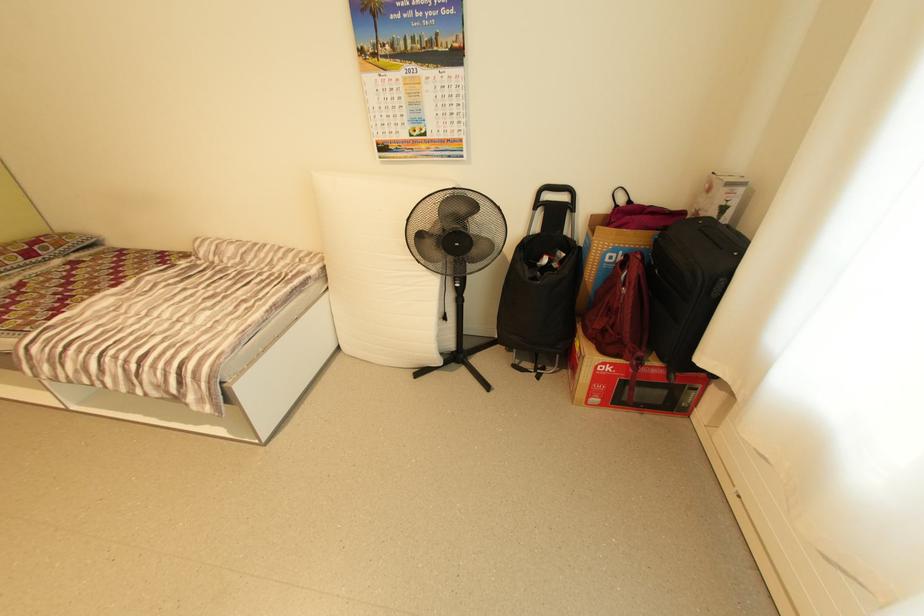
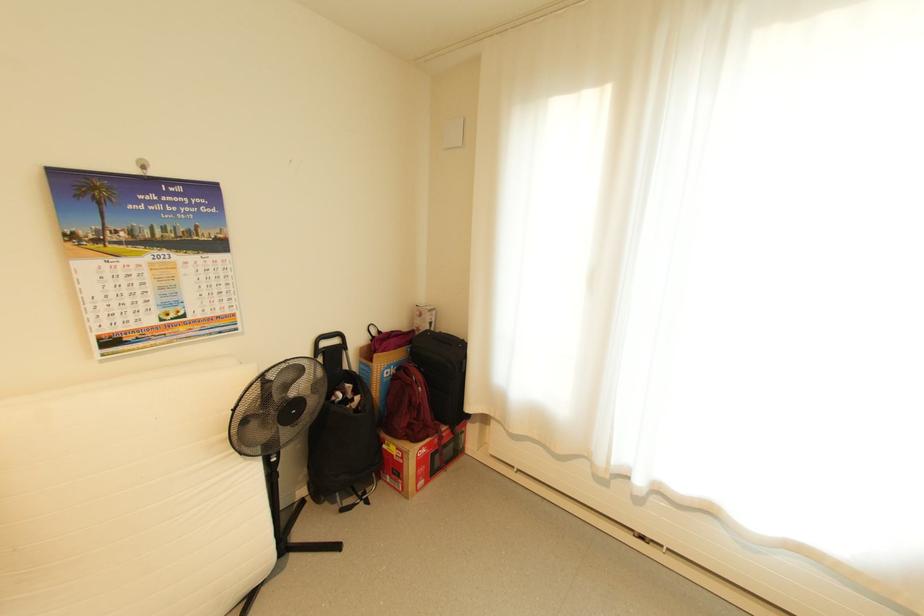
Where in the second image is the point corresponding to (710,215) from the first image?

(429, 330)